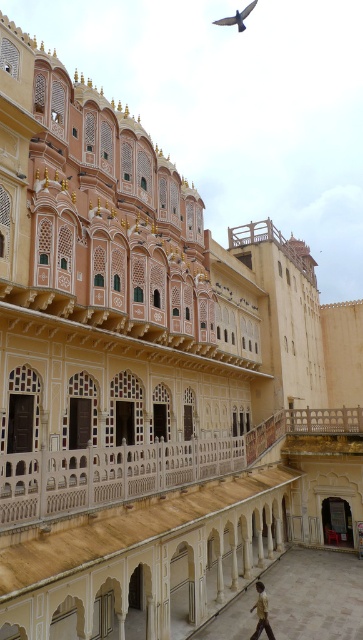
From the picture: Can you confirm if brown textured shirt at lower center is shorter than dark gray feathered bird at upper center?

Correct, brown textured shirt at lower center is not as tall as dark gray feathered bird at upper center.

Does brown textured shirt at lower center appear under dark gray feathered bird at upper center?

Correct, brown textured shirt at lower center is located below dark gray feathered bird at upper center.

Which is in front, point (258, 611) or point (246, 12)?

Point (258, 611)

Where is `brown textured shirt at lower center`? brown textured shirt at lower center is located at coordinates (262, 612).